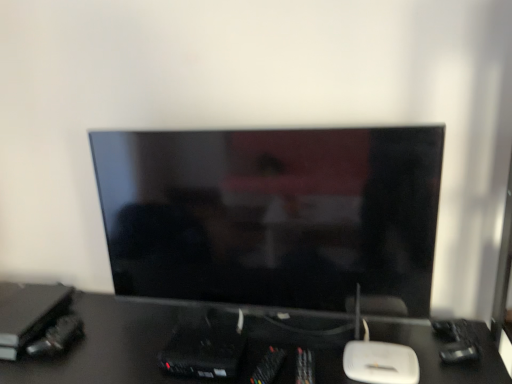
You are a GUI agent. You are given a task and a screenshot of the screen. Output one action in this format:
    pyautogui.click(x=<x>, y=<y>)
    Task: Click on the matte black monitor at center
    
    Given the screenshot: What is the action you would take?
    pyautogui.click(x=271, y=214)

What is the approximate height of matte black monitor at center?

matte black monitor at center is 24.09 inches tall.

The height and width of the screenshot is (384, 512). Describe the element at coordinates (271, 214) in the screenshot. I see `matte black monitor at center` at that location.

What do you see at coordinates (164, 346) in the screenshot? Image resolution: width=512 pixels, height=384 pixels. I see `black glossy desk at center` at bounding box center [164, 346].

You are a GUI agent. You are given a task and a screenshot of the screen. Output one action in this format:
    pyautogui.click(x=<x>, y=<y>)
    Task: Click on the black glossy desk at center
    
    Given the screenshot: What is the action you would take?
    pyautogui.click(x=164, y=346)

This screenshot has height=384, width=512. I want to click on matte black monitor at center, so 271,214.

Is black glossy desk at center to the left or to the right of matte black monitor at center in the image?

From the image, it's evident that black glossy desk at center is to the left of matte black monitor at center.

Which object is further away from the camera, black glossy desk at center or matte black monitor at center?

matte black monitor at center is further from the camera.

Considering the points (86, 359) and (425, 197), which point is in front, point (86, 359) or point (425, 197)?

Positioned in front is point (425, 197).

From the image's perspective, is black glossy desk at center under matte black monitor at center?

Correct, black glossy desk at center appears lower than matte black monitor at center in the image.

From a real-world perspective, between black glossy desk at center and matte black monitor at center, who is vertically lower?

From a 3D spatial view, black glossy desk at center is below.

Considering the relative sizes of black glossy desk at center and matte black monitor at center in the image provided, is black glossy desk at center thinner than matte black monitor at center?

In fact, black glossy desk at center might be wider than matte black monitor at center.

Is black glossy desk at center taller than matte black monitor at center?

No, black glossy desk at center is not taller than matte black monitor at center.

Looking at this image, based on their sizes in the image, would you say black glossy desk at center is bigger or smaller than matte black monitor at center?

Considering their sizes, black glossy desk at center takes up more space than matte black monitor at center.

Is black glossy desk at center inside the boundaries of matte black monitor at center, or outside?

black glossy desk at center cannot be found inside matte black monitor at center.

Is there a large distance between black glossy desk at center and matte black monitor at center?

black glossy desk at center is actually quite close to matte black monitor at center.

Is black glossy desk at center positioned with its back to matte black monitor at center?

No.

Locate an element on the screen. This screenshot has width=512, height=384. desk below the matte black monitor at center (from the image's perspective) is located at coordinates (164, 346).

Considering the relative positions of matte black monitor at center and black glossy desk at center in the image provided, is matte black monitor at center to the right of black glossy desk at center from the viewer's perspective?

Yes.

Which object is further away from the camera taking this photo, matte black monitor at center or black glossy desk at center?

matte black monitor at center is more distant.

Which is less distant, (234,249) or (233,323)?

The point (234,249) is closer.

From the image's perspective, would you say matte black monitor at center is shown under black glossy desk at center?

Incorrect, from the image's perspective, matte black monitor at center is higher than black glossy desk at center.

From a real-world perspective, is matte black monitor at center positioned above or below black glossy desk at center?

matte black monitor at center is situated higher than black glossy desk at center in the real world.

Considering the sizes of objects matte black monitor at center and black glossy desk at center in the image provided, who is wider, matte black monitor at center or black glossy desk at center?

black glossy desk at center is wider.

Is matte black monitor at center taller than black glossy desk at center?

Indeed, matte black monitor at center has a greater height compared to black glossy desk at center.

Is matte black monitor at center bigger than black glossy desk at center?

Incorrect, matte black monitor at center is not larger than black glossy desk at center.

Is matte black monitor at center situated inside black glossy desk at center or outside?

matte black monitor at center cannot be found inside black glossy desk at center.

Is matte black monitor at center placed right next to black glossy desk at center?

No, matte black monitor at center is not in contact with black glossy desk at center.

In the scene shown: Is matte black monitor at center facing towards black glossy desk at center?

No, matte black monitor at center does not turn towards black glossy desk at center.

Locate an element on the screen. The image size is (512, 384). computer monitor on the right of black glossy desk at center is located at coordinates (271, 214).

Locate an element on the screen. This screenshot has width=512, height=384. desk located underneath the matte black monitor at center (from a real-world perspective) is located at coordinates (164, 346).

Where is `computer monitor above the black glossy desk at center (from a real-world perspective)`? Image resolution: width=512 pixels, height=384 pixels. computer monitor above the black glossy desk at center (from a real-world perspective) is located at coordinates (271, 214).